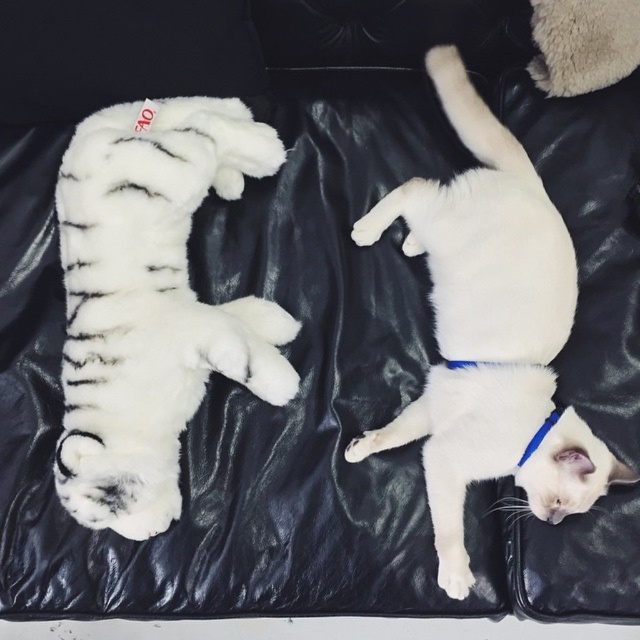
Question: Which of these objects is positioned closest to the white plush toy at left?

Choices:
 (A) blue fabric neckband at lower right
 (B) white fur cat at center

Answer: (B)

Question: Which object is closer to the camera taking this photo?

Choices:
 (A) white fur cat at center
 (B) white plush toy at left
 (C) blue fabric neckband at lower right

Answer: (B)

Question: Is white fur cat at center above blue fabric neckband at lower right?

Choices:
 (A) no
 (B) yes

Answer: (B)

Question: In this image, where is white fur cat at center located relative to blue fabric neckband at lower right?

Choices:
 (A) below
 (B) above

Answer: (B)

Question: From the image, what is the correct spatial relationship of white fur cat at center in relation to blue fabric neckband at lower right?

Choices:
 (A) below
 (B) above

Answer: (B)

Question: Which point is farther to the camera?

Choices:
 (A) (586, 502)
 (B) (131, 371)

Answer: (A)